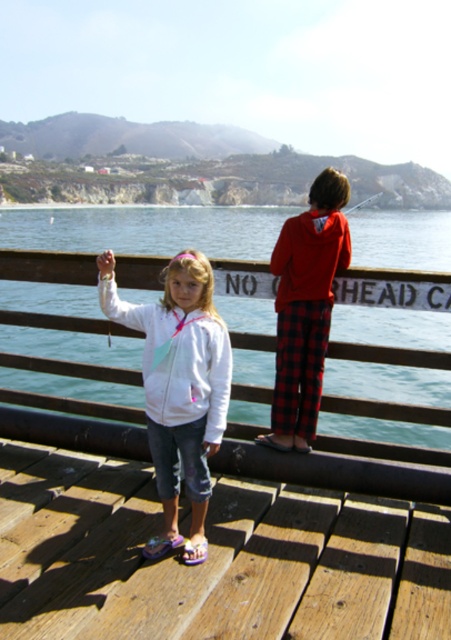
Does blue water at center have a greater height compared to red flannel pants at center?

Indeed, blue water at center has a greater height compared to red flannel pants at center.

Who is higher up, blue water at center or red flannel pants at center?

blue water at center

You are a GUI agent. You are given a task and a screenshot of the screen. Output one action in this format:
    pyautogui.click(x=<x>, y=<y>)
    Task: Click on the blue water at center
    
    Given the screenshot: What is the action you would take?
    pyautogui.click(x=143, y=228)

Between white fleece jacket at center and red flannel pants at center, which one has more height?

white fleece jacket at center

Does point (175, 280) lie in front of point (313, 266)?

Yes.

Does point (175, 282) lie behind point (299, 228)?

No.

What are the coordinates of `white fleece jacket at center` in the screenshot? It's located at [x=179, y=387].

Is blue water at center in front of white fleece jacket at center?

No, it is not.

Find the location of a particular element. blue water at center is located at coordinates (143, 228).

Identify the location of blue water at center. (143, 228).